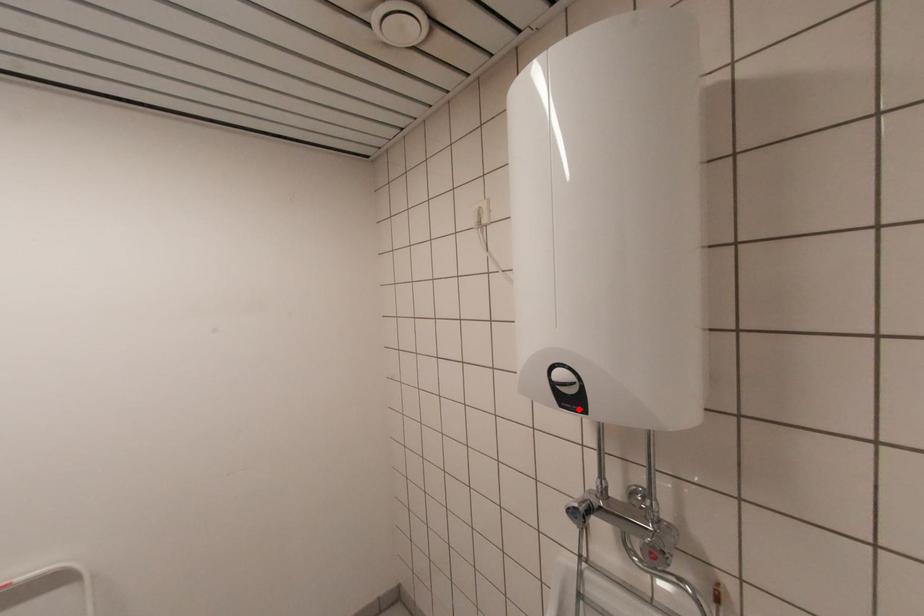
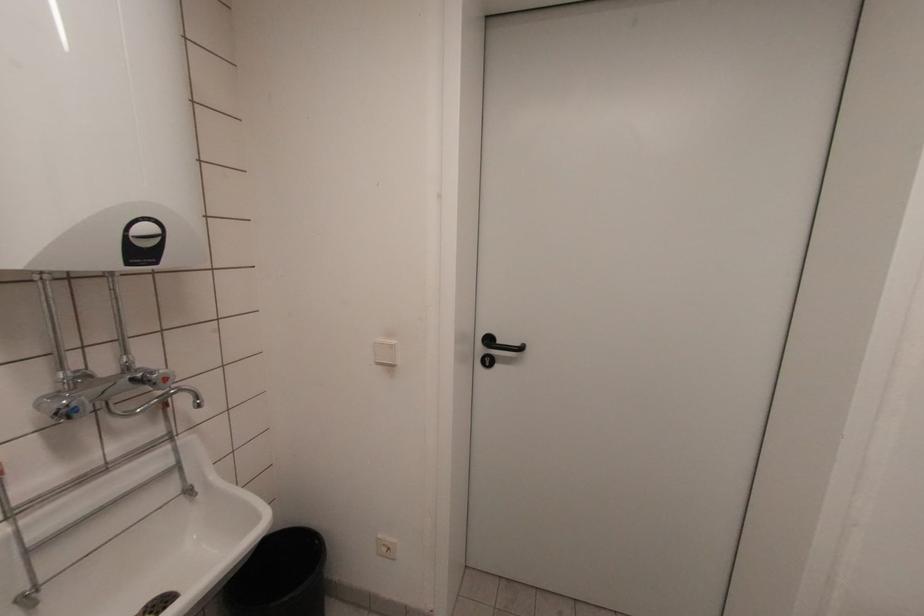
In the second image, find the point that corresponds to the highlighted location in the first image.

(151, 261)